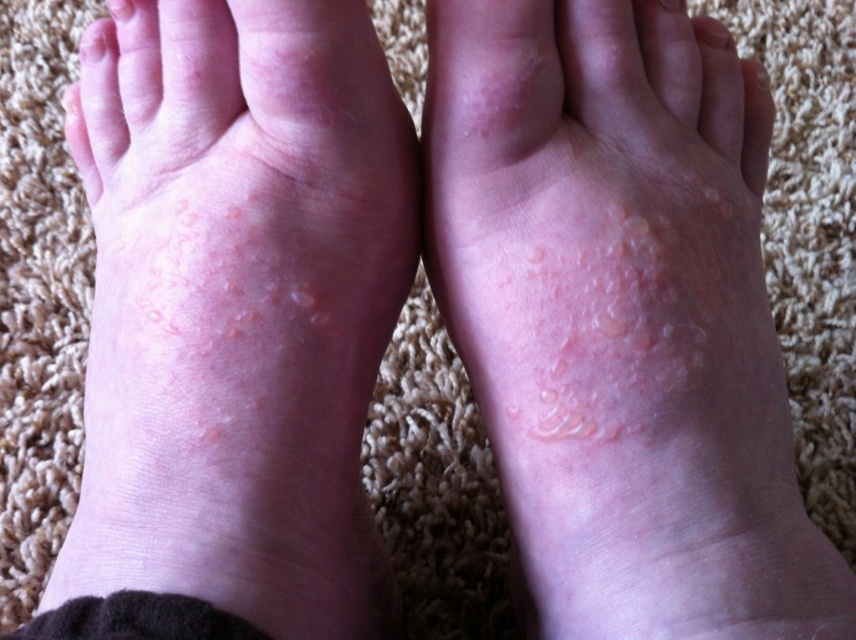
You are a dermatologist examining a patient. You notice the smooth skin at lower center. Where exactly is this area located on the image?

The smooth skin at lower center is located at point coordinates of (135, 620).

You are a dermatologist examining the image of two feet on a carpet. You notice the smooth skin at lower center and the smooth skin at upper center. Which one is positioned lower on the image?

The smooth skin at lower center is positioned lower on the image than the smooth skin at upper center.